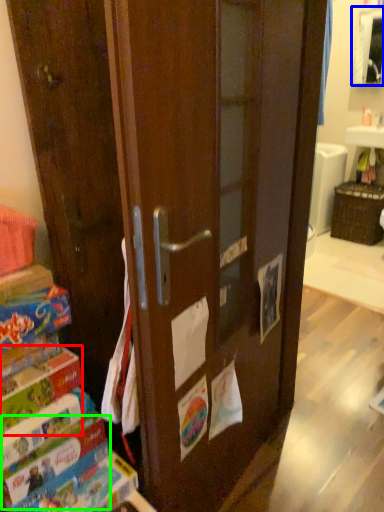
Question: Considering the real-world distances, which object is closest to paperback book (highlighted by a red box)? cabinetry (highlighted by a blue box) or paperback book (highlighted by a green box).

Choices:
 (A) cabinetry
 (B) paperback book

Answer: (B)